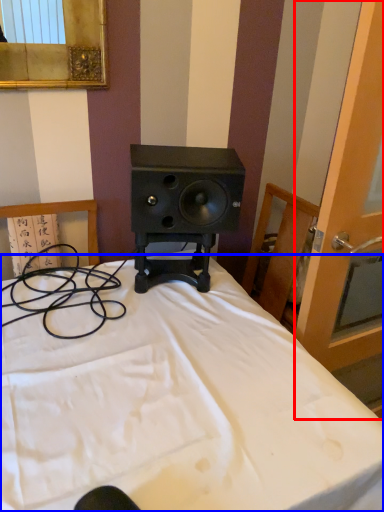
Question: Which point is closer to the camera, screen door (highlighted by a red box) or bed (highlighted by a blue box)?

Choices:
 (A) screen door
 (B) bed

Answer: (B)